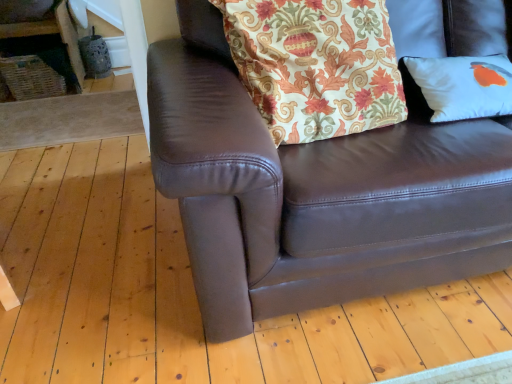
Question: Is floral fabric pillow at upper center facing towards white matte pillow at right?

Choices:
 (A) no
 (B) yes

Answer: (A)

Question: Does floral fabric pillow at upper center have a lesser width compared to white matte pillow at right?

Choices:
 (A) no
 (B) yes

Answer: (A)

Question: Would you say white matte pillow at right is part of floral fabric pillow at upper center's contents?

Choices:
 (A) no
 (B) yes

Answer: (A)

Question: Considering the relative sizes of floral fabric pillow at upper center and white matte pillow at right in the image provided, is floral fabric pillow at upper center taller than white matte pillow at right?

Choices:
 (A) no
 (B) yes

Answer: (B)

Question: Does floral fabric pillow at upper center have a smaller size compared to white matte pillow at right?

Choices:
 (A) yes
 (B) no

Answer: (B)

Question: Considering the relative sizes of floral fabric pillow at upper center and white matte pillow at right in the image provided, is floral fabric pillow at upper center bigger than white matte pillow at right?

Choices:
 (A) yes
 (B) no

Answer: (A)

Question: Is white matte pillow at right to the right of floral fabric pillow at upper center from the viewer's perspective?

Choices:
 (A) no
 (B) yes

Answer: (B)

Question: From the image's perspective, is white matte pillow at right under floral fabric pillow at upper center?

Choices:
 (A) yes
 (B) no

Answer: (A)

Question: Does white matte pillow at right come behind floral fabric pillow at upper center?

Choices:
 (A) yes
 (B) no

Answer: (A)

Question: From the image's perspective, is white matte pillow at right located above floral fabric pillow at upper center?

Choices:
 (A) yes
 (B) no

Answer: (B)

Question: Considering the relative sizes of white matte pillow at right and floral fabric pillow at upper center in the image provided, is white matte pillow at right taller than floral fabric pillow at upper center?

Choices:
 (A) no
 (B) yes

Answer: (A)

Question: From a real-world perspective, is white matte pillow at right positioned under floral fabric pillow at upper center based on gravity?

Choices:
 (A) no
 (B) yes

Answer: (B)

Question: Considering the relative sizes of floral fabric pillow at upper center and brown leather couch at center in the image provided, is floral fabric pillow at upper center wider than brown leather couch at center?

Choices:
 (A) yes
 (B) no

Answer: (B)